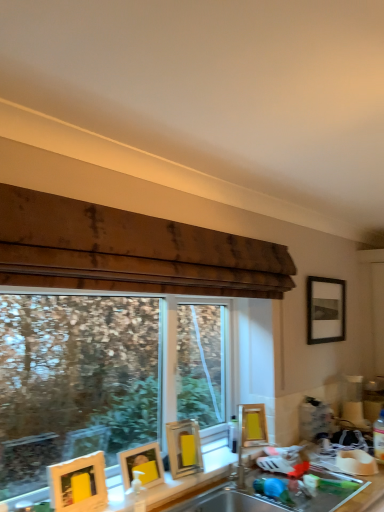
Question: From the image's perspective, would you say yellow matte picture frame at lower center, which is counted as the 3th picture frame, starting from the front, is shown under stainless steel sink at lower center, placed as the second sink when sorted from top to bottom?

Choices:
 (A) yes
 (B) no

Answer: (B)

Question: From a real-world perspective, does yellow matte picture frame at lower center, the third picture frame viewed from the left, stand above stainless steel sink at lower center, placed as the second sink when sorted from top to bottom?

Choices:
 (A) no
 (B) yes

Answer: (B)

Question: Is yellow matte picture frame at lower center, which is counted as the 3th picture frame, starting from the back, bigger than stainless steel sink at lower center, placed as the second sink when sorted from top to bottom?

Choices:
 (A) no
 (B) yes

Answer: (A)

Question: Is yellow matte picture frame at lower center, which is counted as the 3th picture frame, starting from the front, surrounding stainless steel sink at lower center, placed as the second sink when sorted from top to bottom?

Choices:
 (A) no
 (B) yes

Answer: (A)

Question: Is the surface of yellow matte picture frame at lower center, the third picture frame viewed from the left, in direct contact with stainless steel sink at lower center, placed as the second sink when sorted from top to bottom?

Choices:
 (A) yes
 (B) no

Answer: (B)

Question: Does point tap(89, 507) appear closer or farther from the camera than point tap(59, 415)?

Choices:
 (A) closer
 (B) farther

Answer: (A)

Question: Is matte yellow picture frame at lower left, which is counted as the fifth picture frame, starting from the back, inside or outside of transparent glass window at center?

Choices:
 (A) outside
 (B) inside

Answer: (A)

Question: Is matte yellow picture frame at lower left, the 1th picture frame positioned from the front, wider or thinner than transparent glass window at center?

Choices:
 (A) thin
 (B) wide

Answer: (A)

Question: From a real-world perspective, is matte yellow picture frame at lower left, which ranks as the first picture frame in left-to-right order, above or below transparent glass window at center?

Choices:
 (A) below
 (B) above

Answer: (A)

Question: In the image, is matte yellow picture frame at lower left, which ranks as the first picture frame in left-to-right order, on the left side or the right side of matte gold picture frame at lower left, which is the 4th picture frame in right-to-left order?

Choices:
 (A) left
 (B) right

Answer: (A)

Question: Choose the correct answer: Is matte yellow picture frame at lower left, marked as the 5th picture frame in a right-to-left arrangement, inside matte gold picture frame at lower left, which is the 4th picture frame in right-to-left order, or outside it?

Choices:
 (A) outside
 (B) inside

Answer: (A)

Question: Is matte yellow picture frame at lower left, which ranks as the first picture frame in left-to-right order, in front of or behind matte gold picture frame at lower left, marked as the fourth picture frame in a back-to-front arrangement, in the image?

Choices:
 (A) front
 (B) behind

Answer: (A)

Question: From the image's perspective, is matte yellow picture frame at lower left, which ranks as the first picture frame in left-to-right order, located above or below matte gold picture frame at lower left, positioned as the 2th picture frame in front-to-back order?

Choices:
 (A) above
 (B) below

Answer: (A)

Question: From the image's perspective, is matte yellow picture frame at lower left, which is counted as the fifth picture frame, starting from the back, above or below yellow matte picture frame at lower center, which is the 3th picture frame from right to left?

Choices:
 (A) above
 (B) below

Answer: (A)

Question: Would you say matte yellow picture frame at lower left, marked as the 5th picture frame in a right-to-left arrangement, is to the left or to the right of yellow matte picture frame at lower center, which is counted as the 3th picture frame, starting from the back, in the picture?

Choices:
 (A) right
 (B) left

Answer: (B)